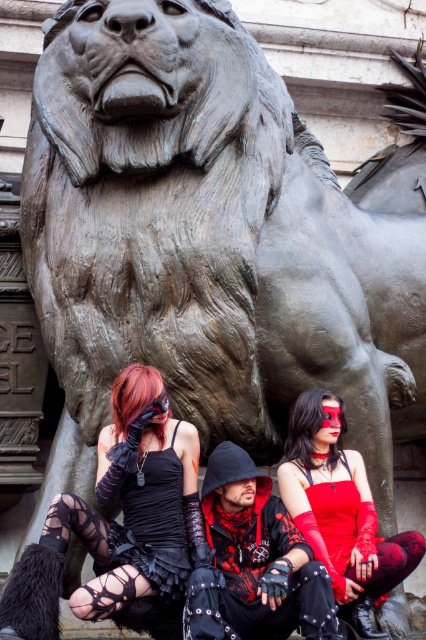
You are standing in front of the lion statue and want to take a photo of both the matte black dress at center and the matte red dress at center. Which dress will appear larger in the photo?

The matte black dress at center will appear larger in the photo because it is closer to the viewer than the matte red dress at center.

You are a photographer trying to capture the matte black dress at center and the matte red dress at center in a photo. Since the dresses are layered, which dress will appear in front of the other in the final image?

The matte black dress at center is positioned over matte red dress at center, so it will appear in front of the matte red dress at center in the photo.